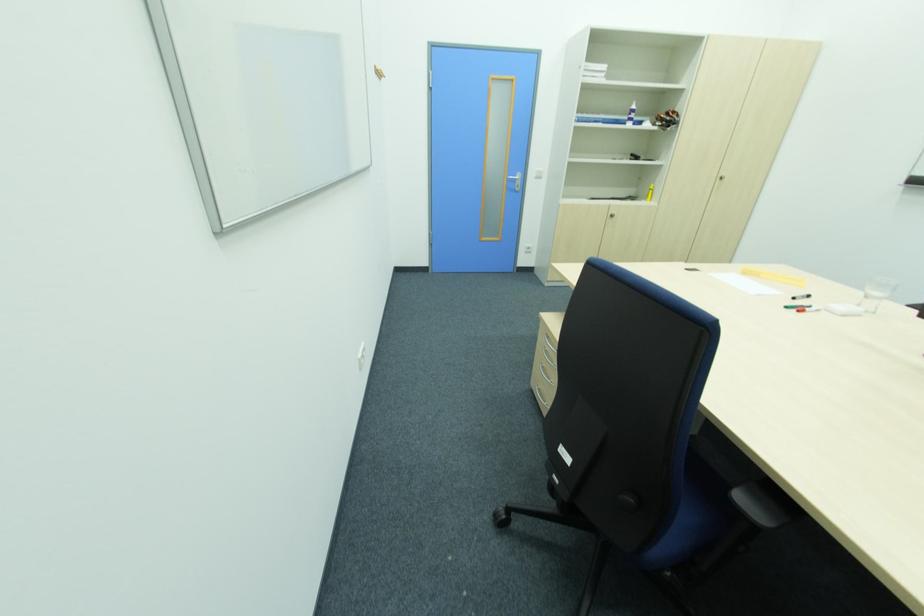
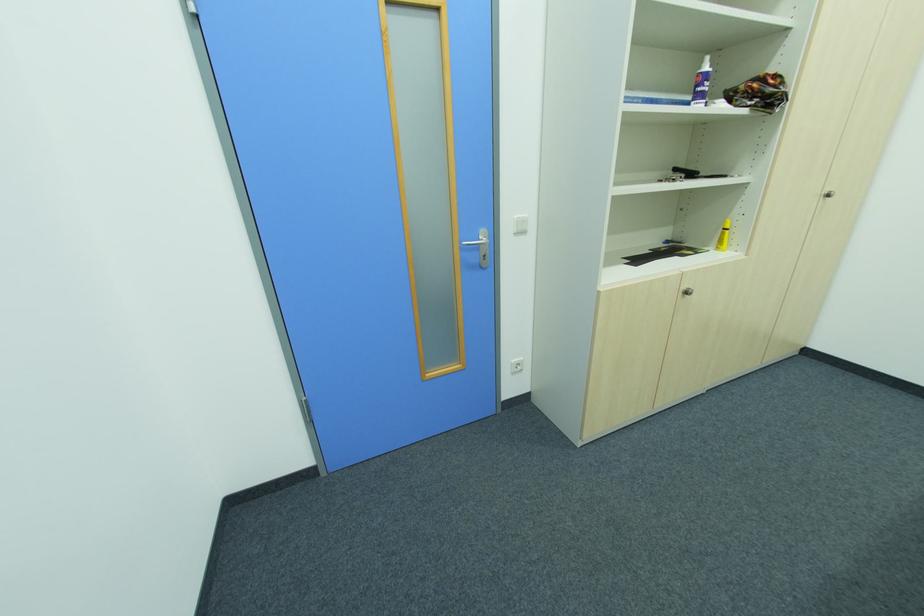
Locate, in the second image, the point that corresponds to point 614,217 in the first image.

(689, 294)